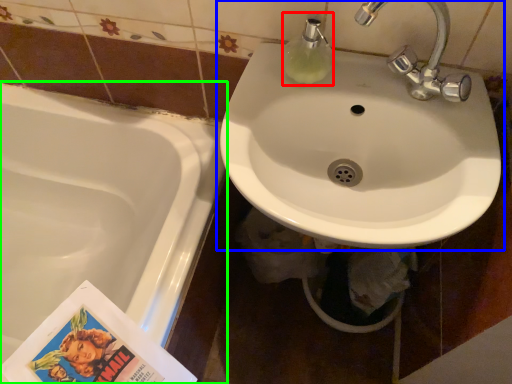
Question: Estimate the real-world distances between objects in this image. Which object is closer to soap dispenser (highlighted by a red box), sink (highlighted by a blue box) or bathtub (highlighted by a green box)?

Choices:
 (A) sink
 (B) bathtub

Answer: (A)